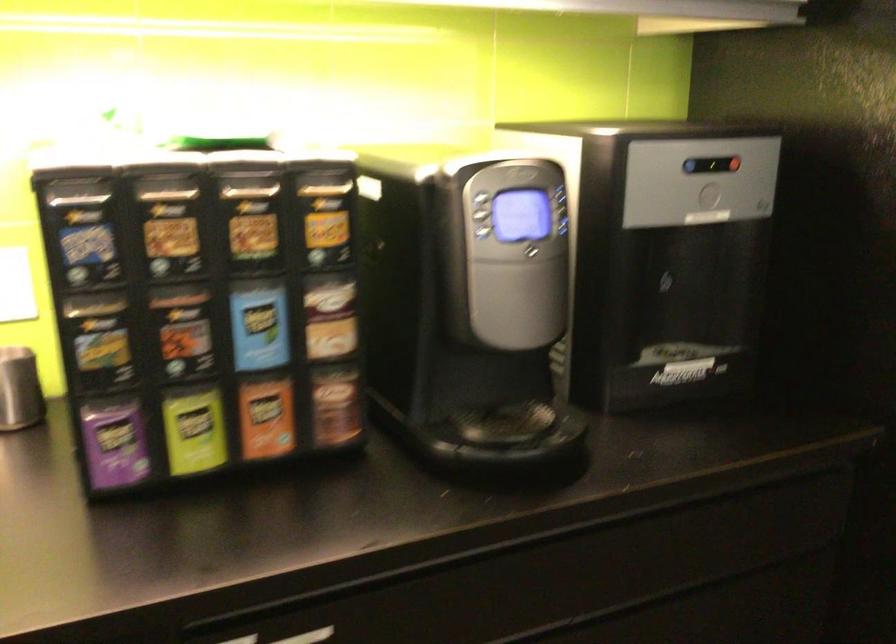
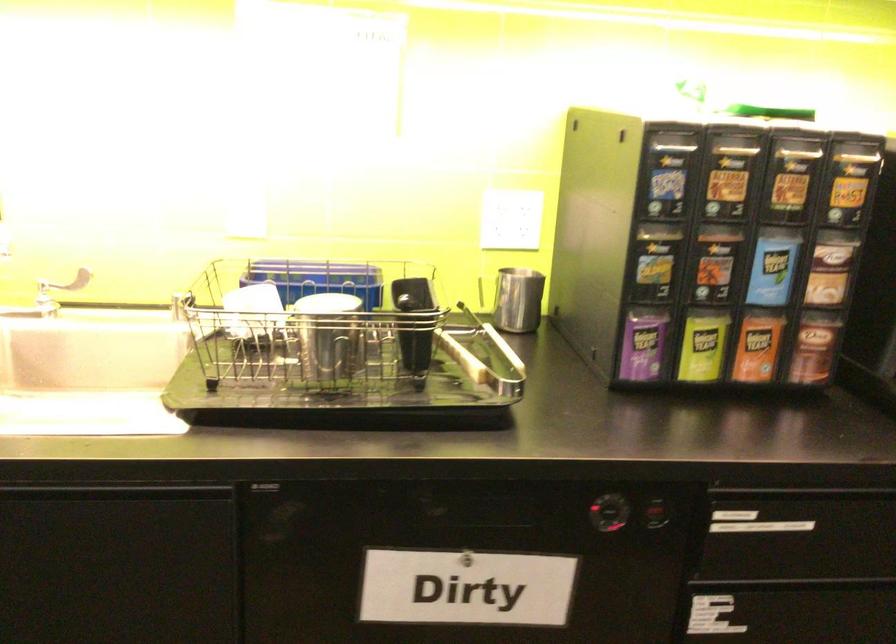
Question: The images are taken continuously from a first-person perspective. In which direction is your viewpoint rotating?

Choices:
 (A) Left
 (B) Right
 (C) Up
 (D) Down

Answer: (A)